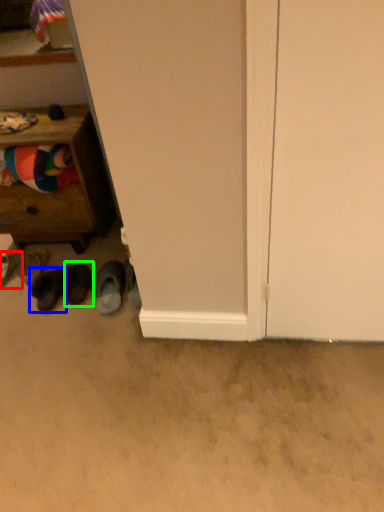
Question: Estimate the real-world distances between objects in this image. Which object is closer to footwear (highlighted by a red box), footwear (highlighted by a blue box) or footwear (highlighted by a green box)?

Choices:
 (A) footwear
 (B) footwear

Answer: (A)